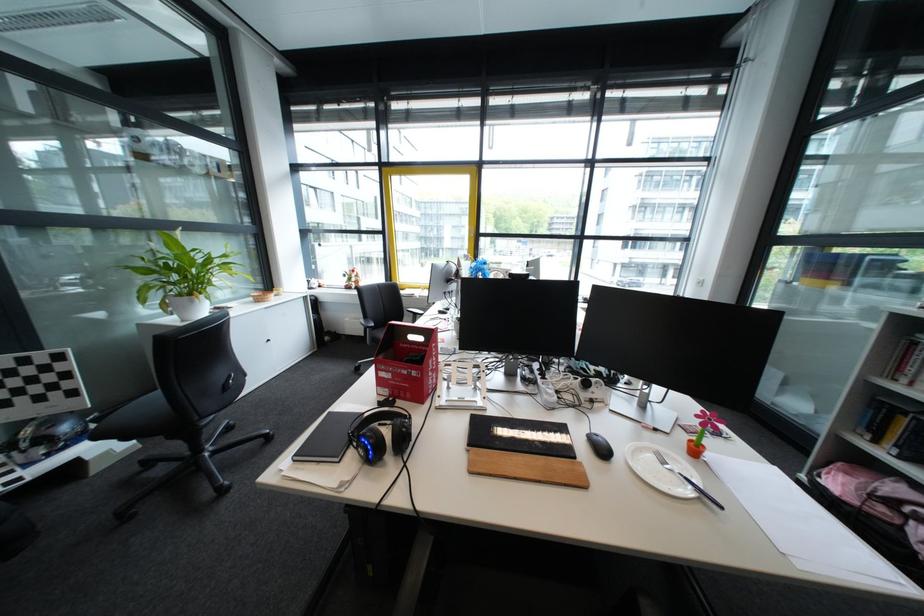
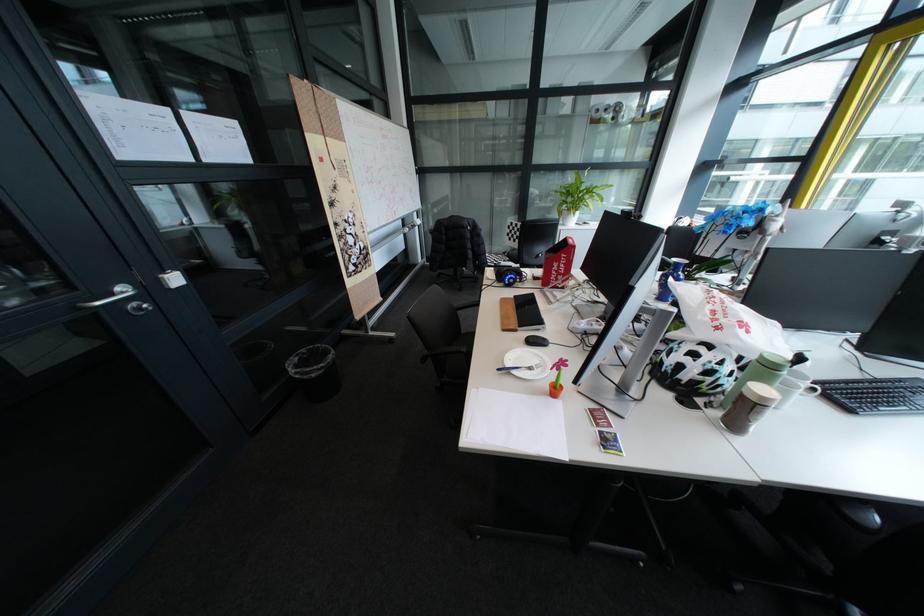
Locate, in the second image, the point that corresponds to (x=152, y=299) in the first image.

(572, 209)